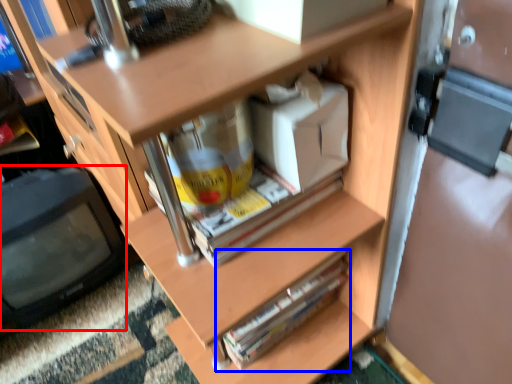
Question: Which object is closer to the camera taking this photo, computer monitor (highlighted by a red box) or paperback book (highlighted by a blue box)?

Choices:
 (A) computer monitor
 (B) paperback book

Answer: (B)